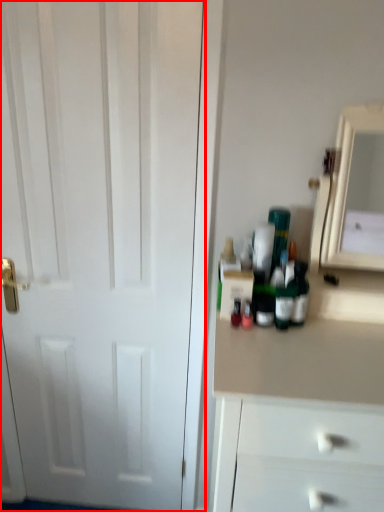
Question: From the image's perspective, where is door (annotated by the red box) located relative to medicine cabinet?

Choices:
 (A) above
 (B) below

Answer: (B)